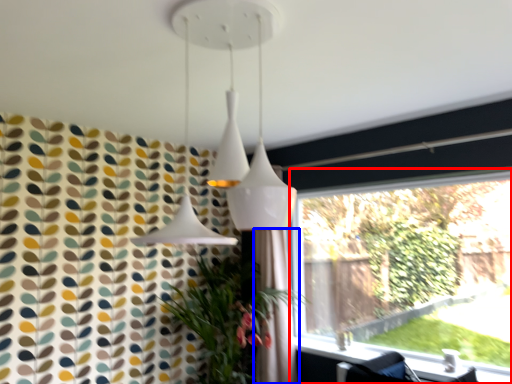
Question: Among these objects, which one is farthest to the camera, window (highlighted by a red box) or shower curtain (highlighted by a blue box)?

Choices:
 (A) window
 (B) shower curtain

Answer: (B)